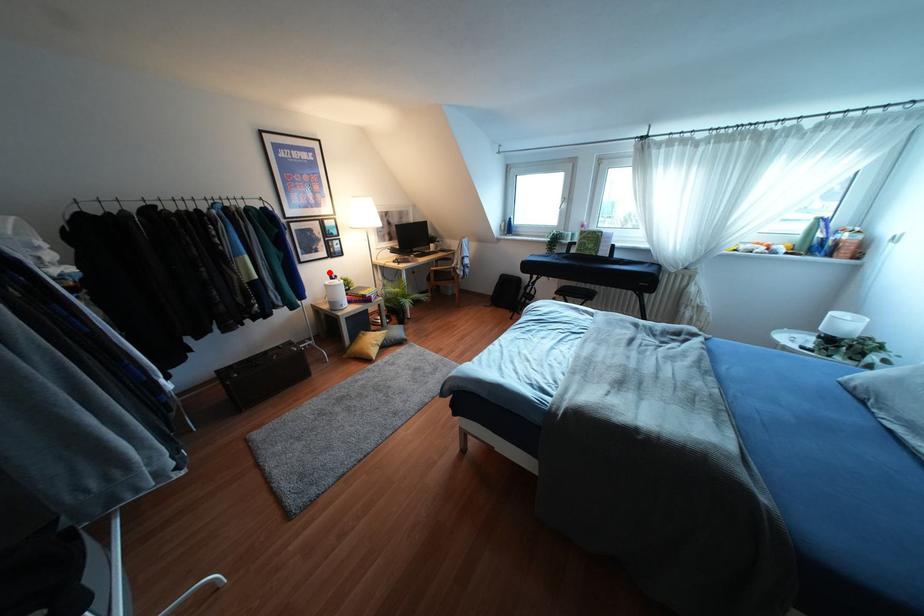
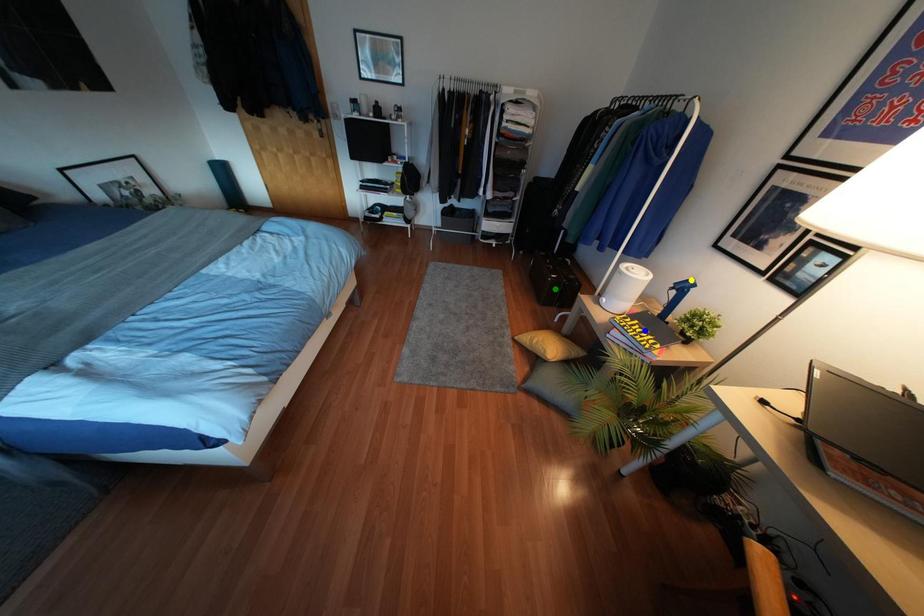
Question: I am providing you with two images of the same scene from different viewpoints. A red point is marked on the first image. You are given multiple points on the second image. Which point in image 2 is actually the same real-world point as the red point in image 1?

Choices:
 (A) green point
 (B) yellow point
 (C) blue point

Answer: (B)